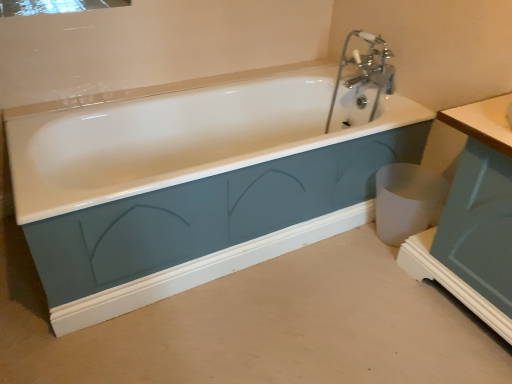
Question: Is point (409, 248) closer or farther from the camera than point (397, 231)?

Choices:
 (A) farther
 (B) closer

Answer: (B)

Question: Is matte teal cabinet at right inside the boundaries of white matte trash can at lower right, or outside?

Choices:
 (A) inside
 (B) outside

Answer: (B)

Question: Which object is positioned farthest from the white matte trash can at lower right?

Choices:
 (A) matte teal cabinet at right
 (B) white glossy bathtub at center
 (C) clear glass mirror at upper left

Answer: (C)

Question: Based on their relative distances, which object is farther from the clear glass mirror at upper left?

Choices:
 (A) white glossy bathtub at center
 (B) white matte trash can at lower right
 (C) matte teal cabinet at right

Answer: (C)